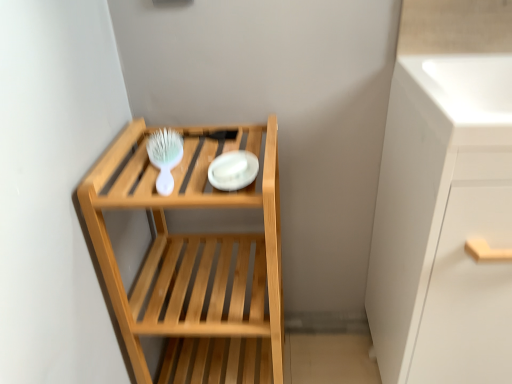
Question: Looking at their shapes, would you say natural wood shelf at center is wider or thinner than white glossy plate at center?

Choices:
 (A) wide
 (B) thin

Answer: (A)

Question: From the image's perspective, is natural wood shelf at center located above or below white glossy plate at center?

Choices:
 (A) above
 (B) below

Answer: (B)

Question: Based on their relative distances, which object is nearer to the white glossy plate at center?

Choices:
 (A) white glossy cabinet at right
 (B) natural wood shelf at center
 (C) white plastic brush at upper left
 (D) white glossy sink at upper right

Answer: (C)

Question: Estimate the real-world distances between objects in this image. Which object is farther from the white glossy cabinet at right?

Choices:
 (A) natural wood shelf at center
 (B) white glossy sink at upper right
 (C) white glossy plate at center
 (D) white plastic brush at upper left

Answer: (D)